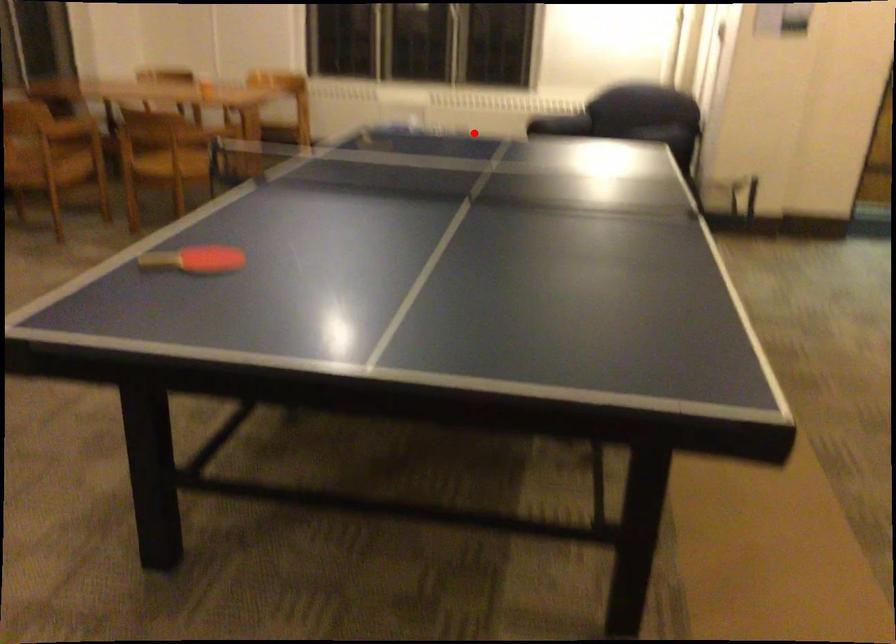
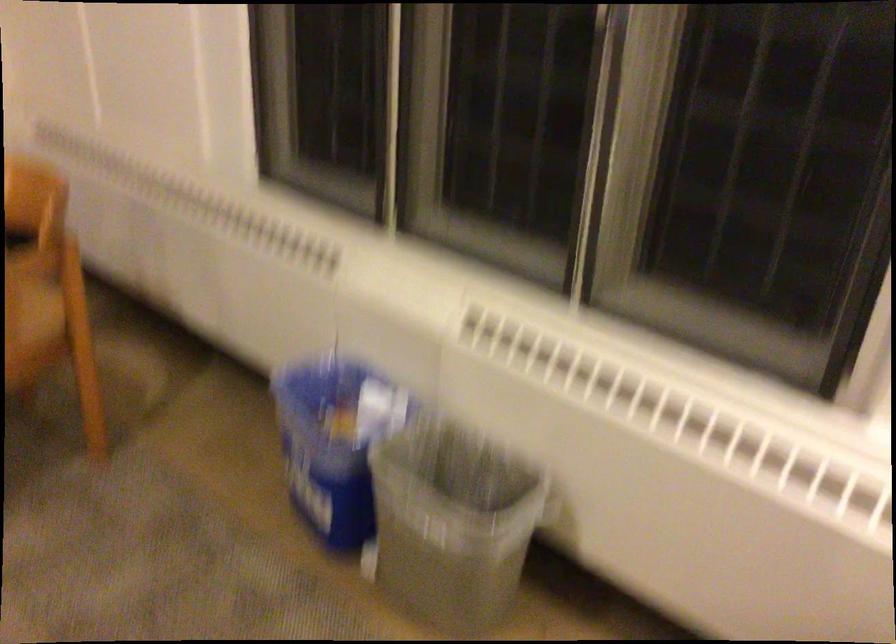
Question: A red point is marked in image1. In image2, is the corresponding 3D point closer to the camera or farther? Reply with the corresponding letter.

Choices:
 (A) The corresponding 3D point is closer.
 (B) The corresponding 3D point is farther.

Answer: (A)